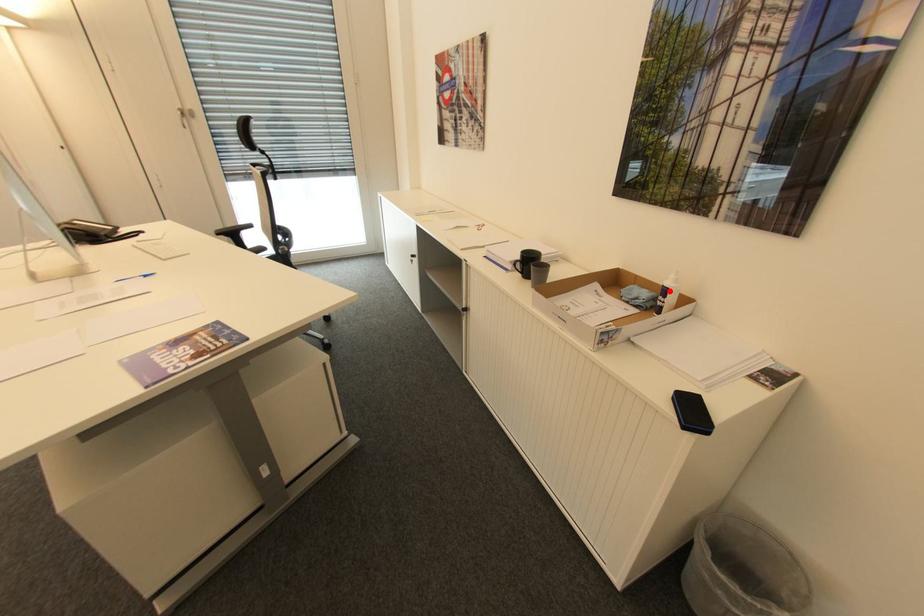
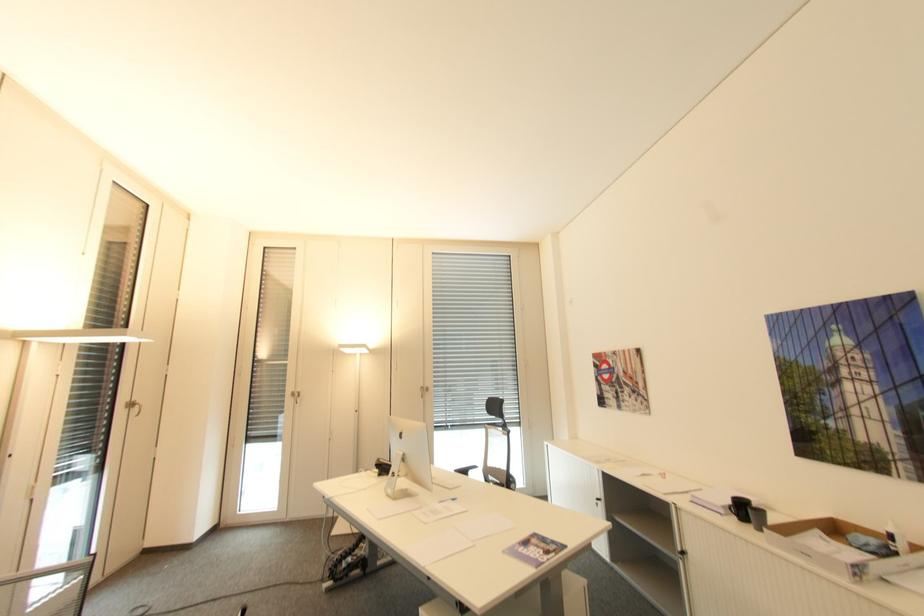
Question: A red point is marked in image1. In image2, is the corresponding 3D point closer to the camera or farther? Reply with the corresponding letter.

Choices:
 (A) The corresponding 3D point is closer.
 (B) The corresponding 3D point is farther.

Answer: (A)